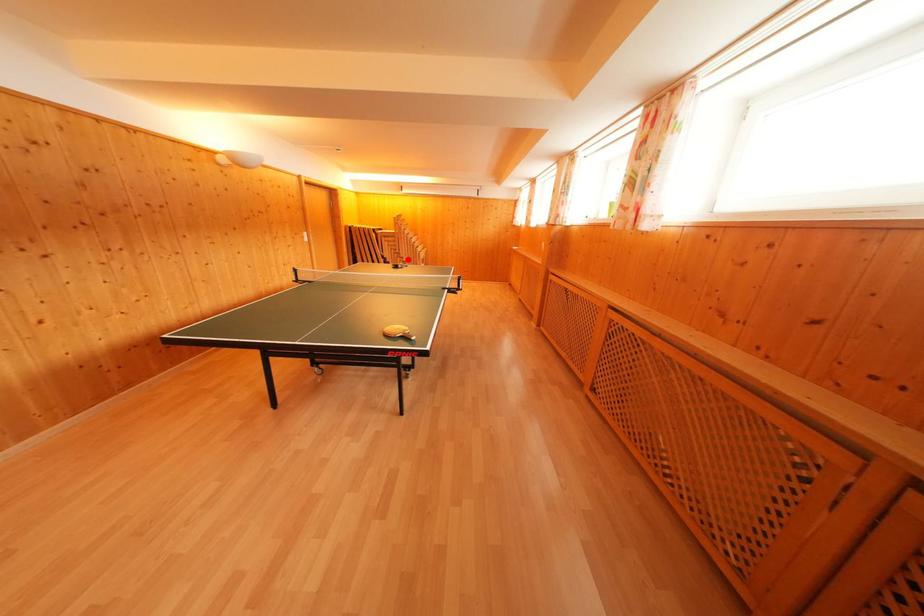
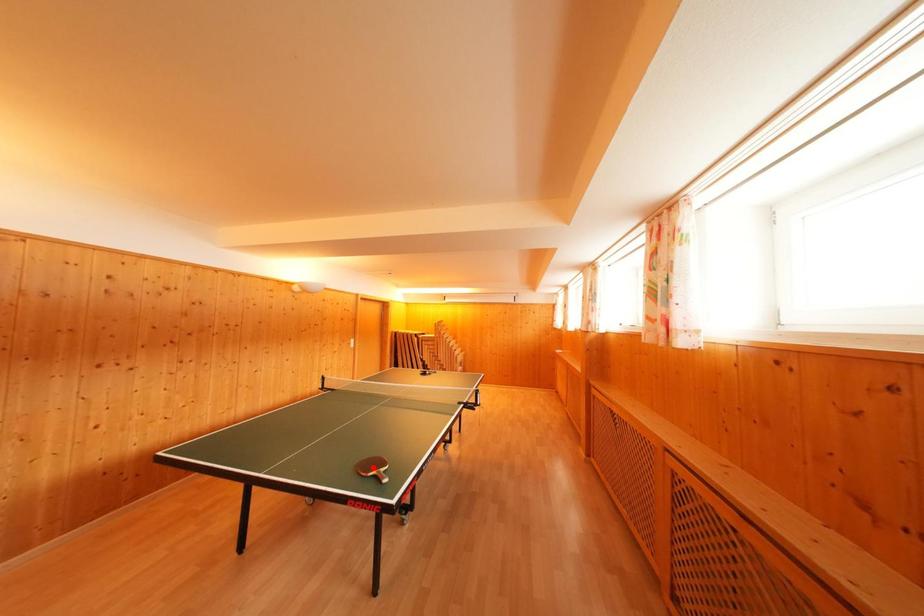
I am providing you with two images of the same scene from different viewpoints. A red point is marked on the first image and another point is marked on the second image. Is the marked point in image1 the same physical position as the marked point in image2?

No